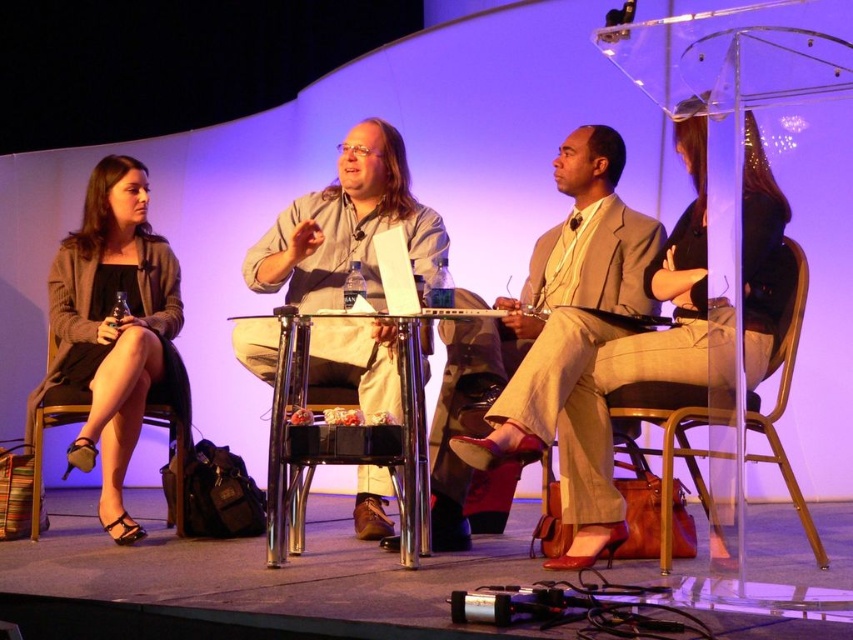
You are an event organizer and need to place a name tag on the stage. The name tag must be placed exactly at the coordinates of the light beige suit at center. Where should you place it?

The light beige suit at center is located at coordinates point (537, 340), so place the name tag there.

You are an event organizer who needs to adjust seating for accessibility. The metallic gold chair at right and the black leather chair at lower left are in the way of the ramp. Which chair should be moved to the left to clear the path?

The metallic gold chair at right should be moved to the left since it is positioned to the right of the black leather chair at lower left, making it the one obstructing the ramp access.